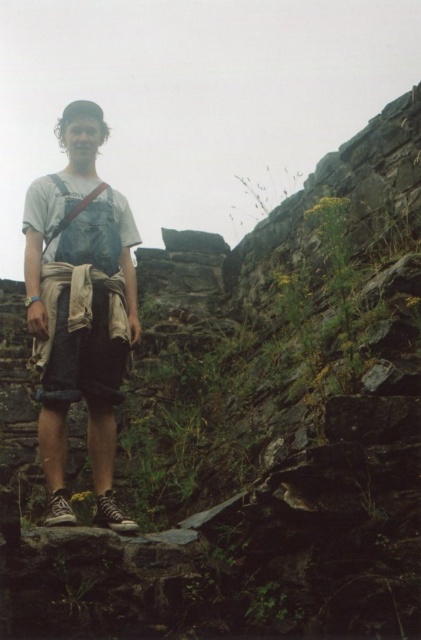
Question: Where is denim shorts at center located in relation to denim suspenders at center in the image?

Choices:
 (A) below
 (B) above

Answer: (A)

Question: Does denim overalls at center lie behind denim shorts at center?

Choices:
 (A) yes
 (B) no

Answer: (B)

Question: Among these points, which one is farthest from the camera?

Choices:
 (A) (50, 179)
 (B) (119, 268)

Answer: (B)

Question: Which object is the closest to the denim shorts at center?

Choices:
 (A) denim suspenders at center
 (B) denim overalls at center

Answer: (B)

Question: Among these objects, which one is farthest from the camera?

Choices:
 (A) denim shorts at center
 (B) denim overalls at center
 (C) denim suspenders at center

Answer: (C)

Question: Is denim shorts at center above denim suspenders at center?

Choices:
 (A) no
 (B) yes

Answer: (A)